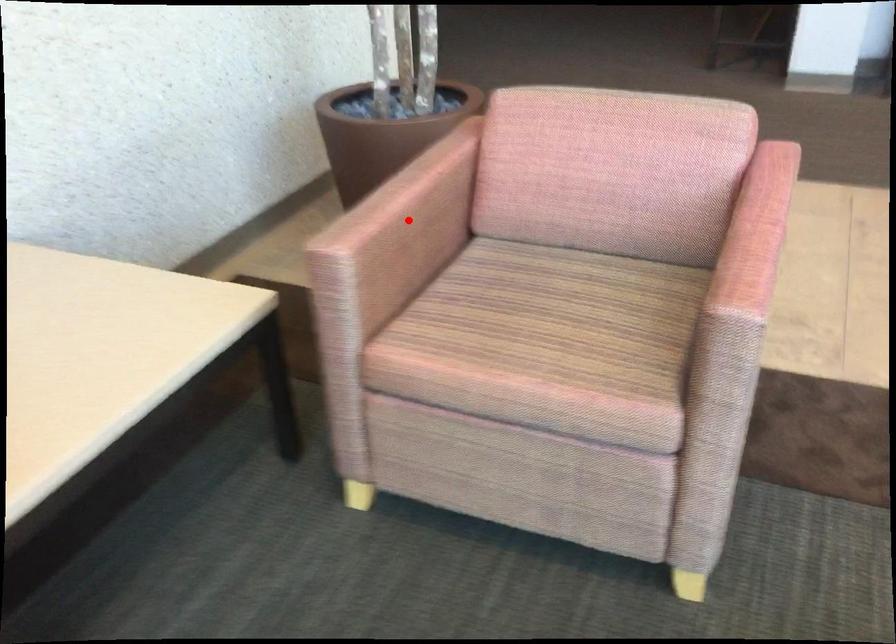
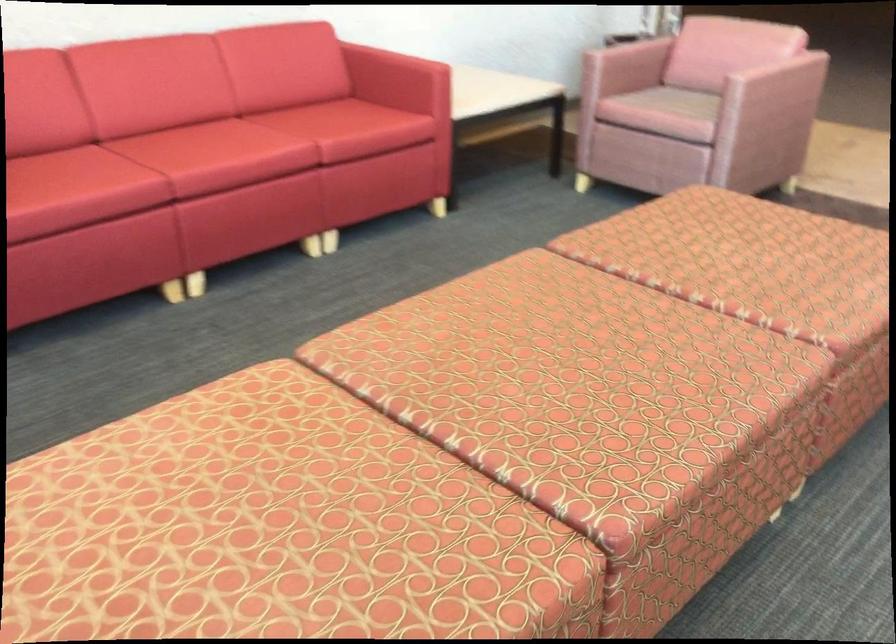
In the second image, find the point that corresponds to the highlighted location in the first image.

(627, 58)